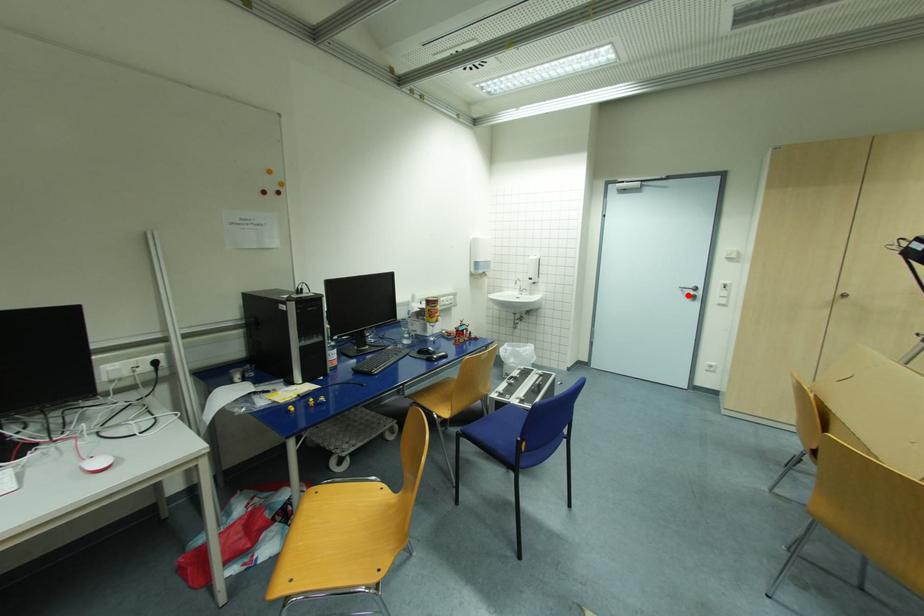
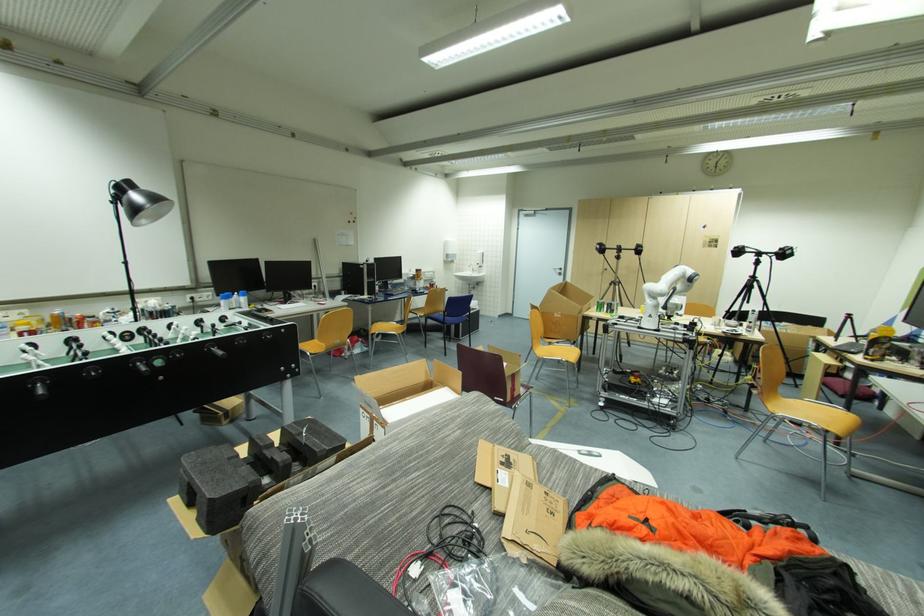
Where in the second image is the point corresponding to the highlighted location from the first image?

(560, 273)